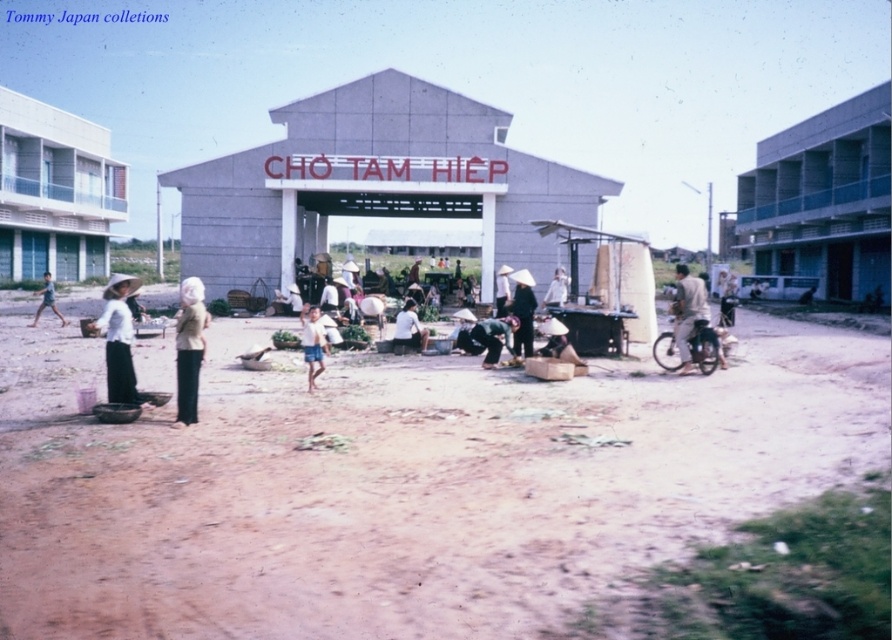
In the bustling outdoor market scene, there is a light brown fabric child at center represented by point (47, 300). What is the position of the point relative to the gray building with triangular roof?

The point (47, 300) is located at the center of the image, which is in front of the gray building with the triangular roof. This position suggests that the light brown fabric child at center is positioned in the open area in front of the market building.

You are standing in the market and see both the dark brown leather jacket at right and the white cotton hat at center. Which item is positioned more to the right side of the scene?

The dark brown leather jacket at right is positioned more to the right than the white cotton hat at center.